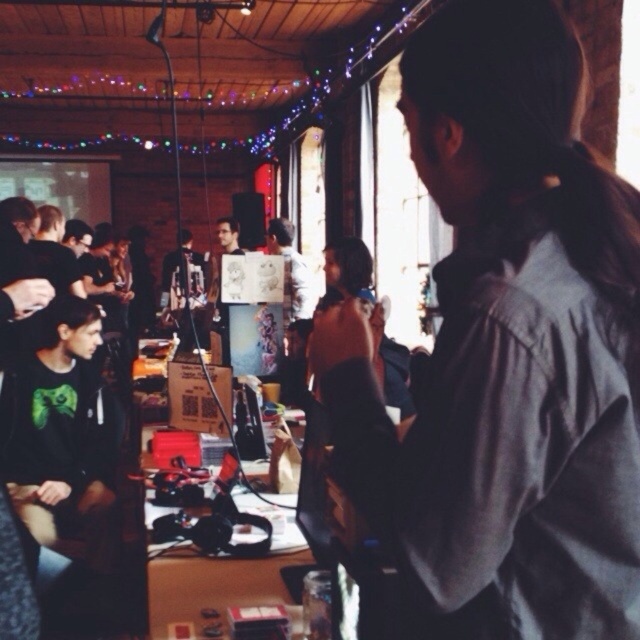
Where is the black matte shirt at lower left located in the image?

The black matte shirt at lower left is located at the 2D coordinates point (60, 426).

You are organizing a photo shoot and need to decide which participant to feature based on their clothing. The gray shirt at upper right and the matte black shirt at left are both options. Which shirt would you choose if you want to highlight a smaller size in your composition?

The gray shirt at upper right has a smaller size compared to the matte black shirt at left, so it would be the better choice to highlight a smaller size in the composition.

You are standing in the room and want to take a photo of both the gray shirt at upper right and the black matte shirt at lower left. Can you see both shirts clearly in your camera frame without moving your position?

The gray shirt at upper right is in front of the black matte shirt at lower left, so the gray shirt at upper right may block part of the black matte shirt at lower left from your view, making it harder to see both clearly at the same time.